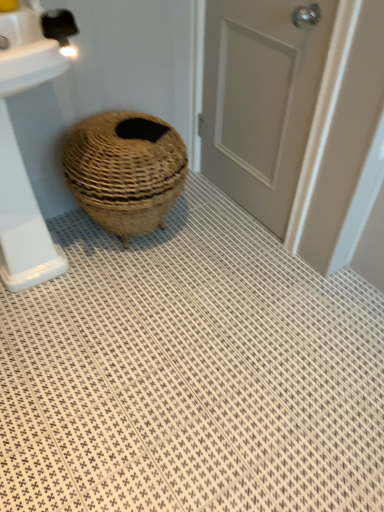
Image resolution: width=384 pixels, height=512 pixels. What are the coordinates of `space that is in front of white glossy sink at left` in the screenshot? It's located at (63, 350).